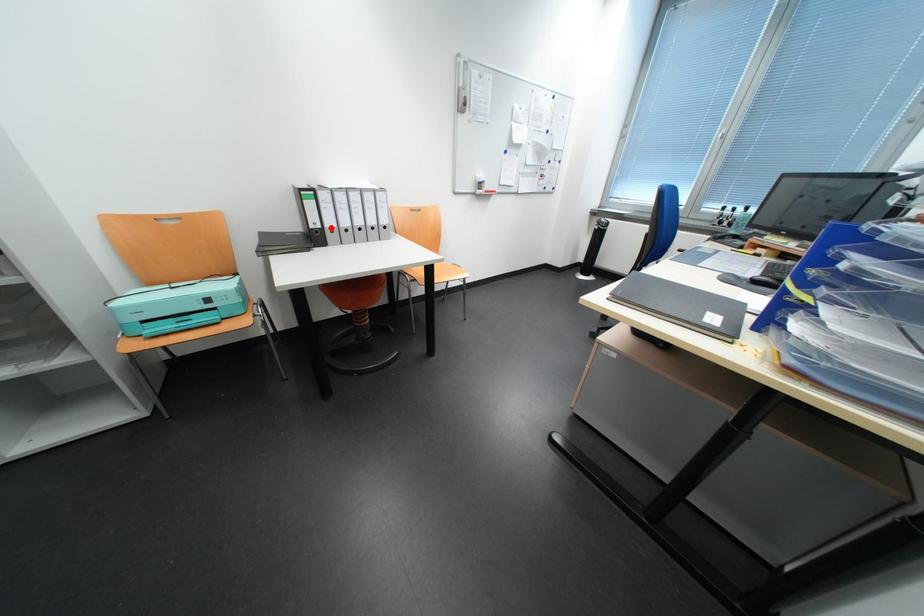
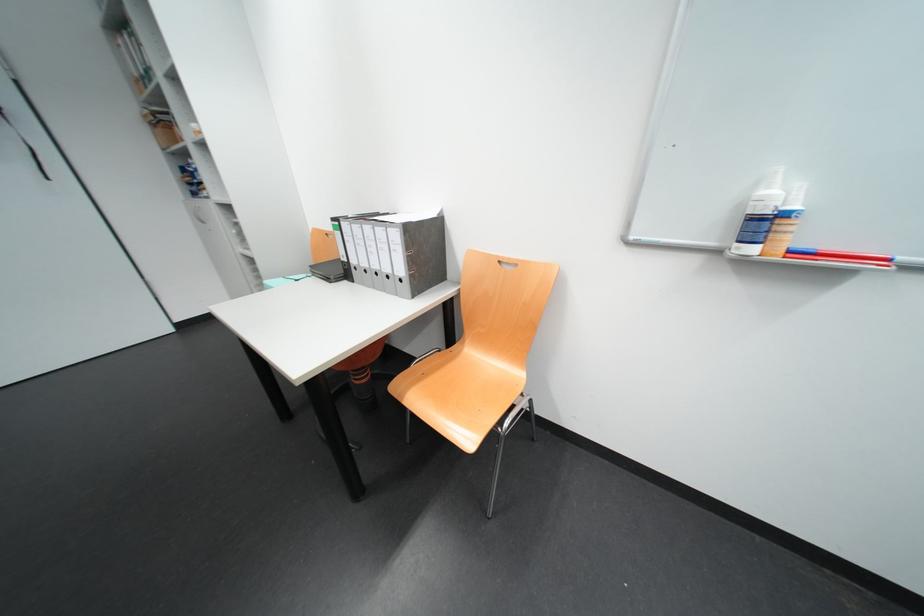
Question: I am providing you with two images of the same scene from different viewpoints. In image1, a red point is highlighted. Considering the same 3D point in image2, which of the following is correct?

Choices:
 (A) It is closer
 (B) It is farther

Answer: (B)